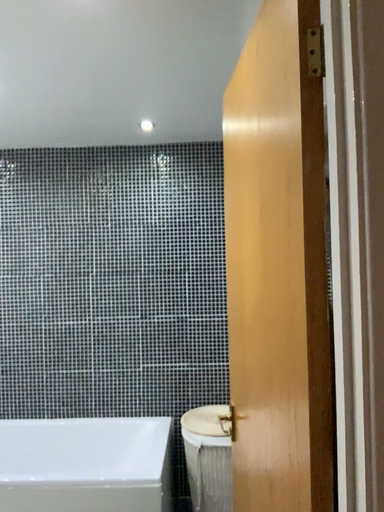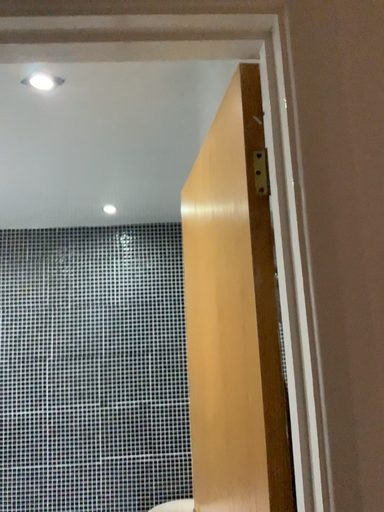
Question: Which way did the camera rotate in the video?

Choices:
 (A) rotated downward
 (B) rotated upward

Answer: (B)